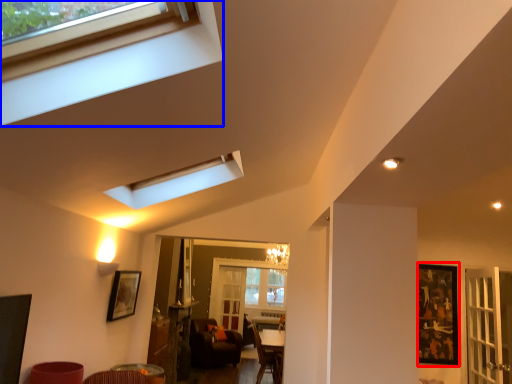
Question: Which of the following is the closest to the observer, picture frame (highlighted by a red box) or window (highlighted by a blue box)?

Choices:
 (A) picture frame
 (B) window

Answer: (B)